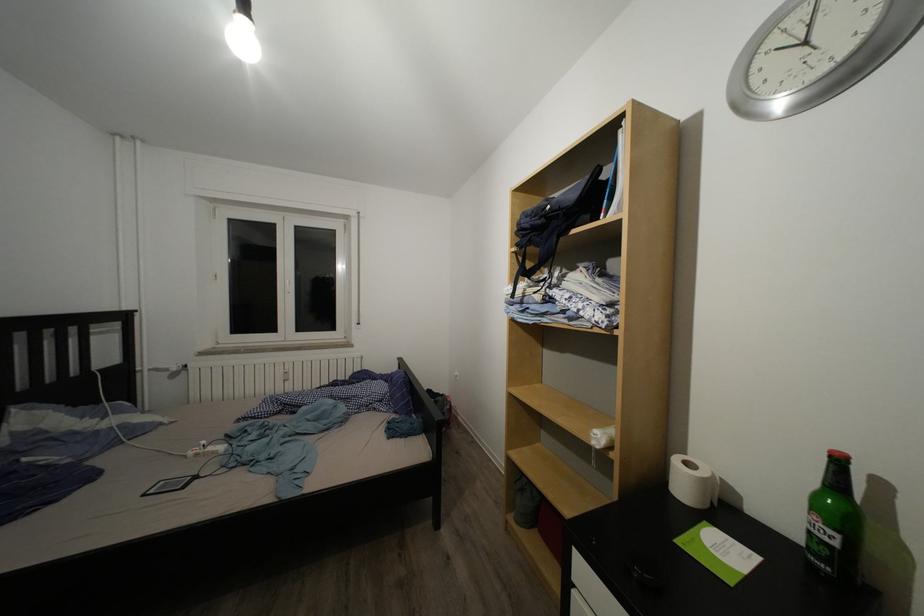
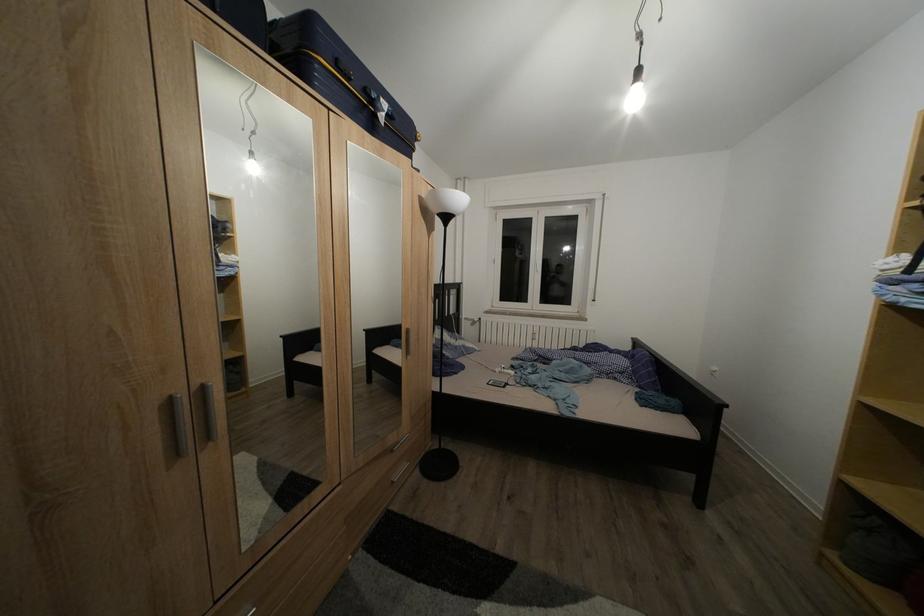
Question: Based on the continuous images, in which direction is the camera rotating? Reply with the corresponding letter.

Choices:
 (A) Left
 (B) Right
 (C) Up
 (D) Down

Answer: (A)